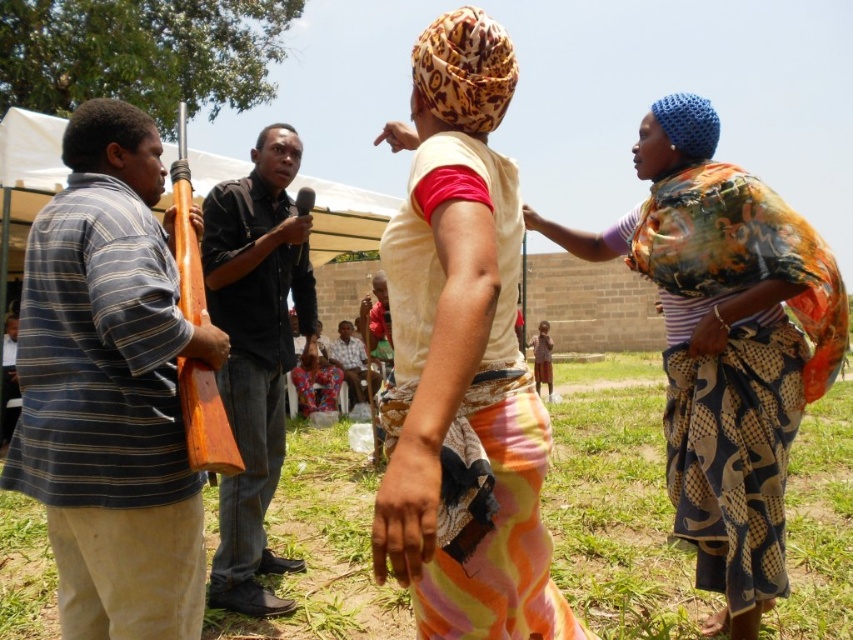
Question: Can you confirm if black shirt at center is thinner than red fabric shirt at center?

Choices:
 (A) no
 (B) yes

Answer: (A)

Question: Among these objects, which one is farthest from the camera?

Choices:
 (A) white cotton shirt at center
 (B) dirt field at lower center

Answer: (A)

Question: Does wooden rifle at left appear on the left side of dirt field at lower center?

Choices:
 (A) yes
 (B) no

Answer: (A)

Question: Which point appears closest to the camera in this image?

Choices:
 (A) (361, 356)
 (B) (676, 563)
 (C) (172, 339)

Answer: (C)

Question: Is wooden rifle at left thinner than multicolored woven cloth at right?

Choices:
 (A) yes
 (B) no

Answer: (A)

Question: Which point is closer to the camera taking this photo?

Choices:
 (A) (370, 342)
 (B) (347, 321)

Answer: (A)